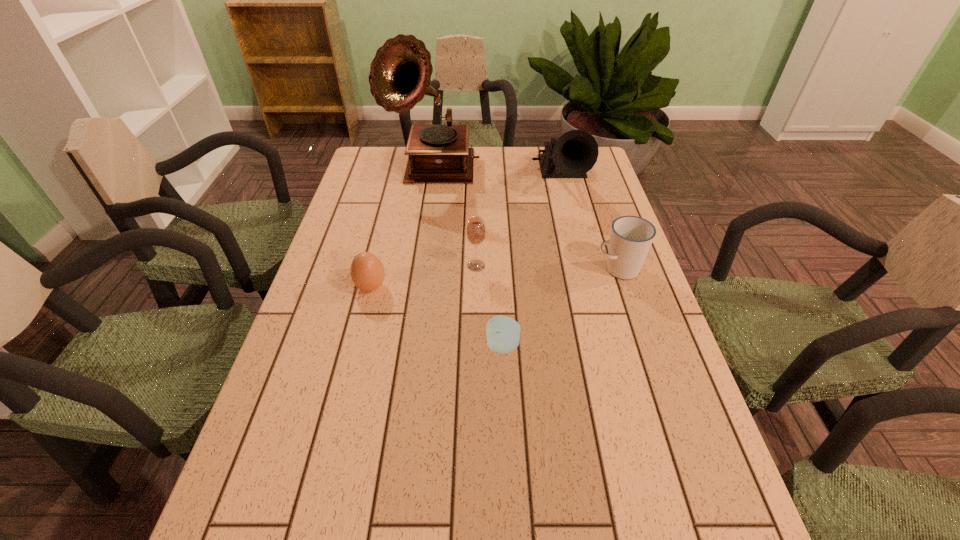
The width and height of the screenshot is (960, 540). In order to click on cup located at the right edge in this screenshot , I will do `click(631, 237)`.

You are a GUI agent. You are given a task and a screenshot of the screen. Output one action in this format:
    pyautogui.click(x=<x>, y=<y>)
    Task: Click on the object at the far left corner
    The width and height of the screenshot is (960, 540).
    Given the screenshot: What is the action you would take?
    pyautogui.click(x=400, y=74)

Locate an element on the screen. This screenshot has height=540, width=960. object at the far right corner is located at coordinates (572, 155).

Find the location of a particular element. Image resolution: width=960 pixels, height=540 pixels. vacant space at the far edge of the desktop is located at coordinates (523, 166).

In the image, there is a desktop. Identify the location of vacant space at the left edge. (365, 218).

Where is `vacant space at the right edge of the desktop`? vacant space at the right edge of the desktop is located at coordinates (606, 343).

Image resolution: width=960 pixels, height=540 pixels. I want to click on free spot between the fifth shortest object and the record player, so click(x=496, y=175).

I want to click on unoccupied area between the wineglass and the nearest object, so click(490, 306).

Find the location of a particular element. This screenshot has height=540, width=960. free point between the boiled egg and the nearest object is located at coordinates tap(437, 316).

Where is `free space between the record player and the fifth tallest object`? free space between the record player and the fifth tallest object is located at coordinates (401, 228).